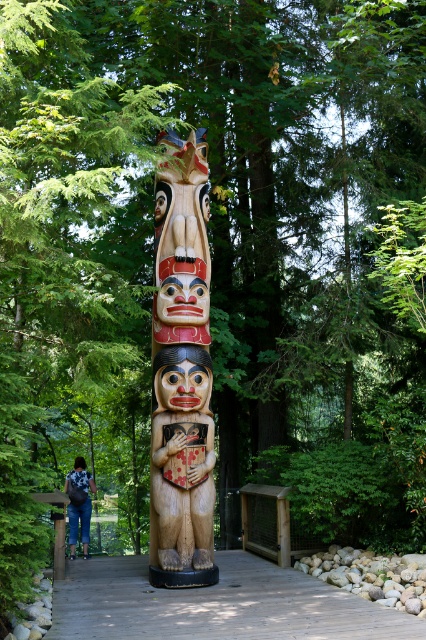
You are standing on the wooden walkway at center and want to reach a nearby bench that is 10 feet away from you. Can you safely walk to the bench without stepping off the walkway?

The wooden walkway at center and viewer are 15.84 feet apart from each other. Since the bench is only 10 feet away from you, you can safely walk to the bench without leaving the walkway as it is within the 15.84 feet distance between you and the walkway.

You are an artist trying to sketch the totem pole. You notice two points on the totem pole labeled as point (276, 596) and point (94, 486). Which point should you focus on first if you want to start drawing the part of the totem pole that is closer to you?

Point (276, 596) is closer to the viewer than point (94, 486), so you should focus on point (276, 596) first.

You are a painter with a 1.5 meter wide canvas. You want to paint the carved wood totem pole at center and the wooden walkway at center in the scene. Can your canvas accommodate both objects side by side?

The carved wood totem pole at center is narrower than the wooden walkway at center. The combined width of both objects would depend on their individual widths. However, since the totem pole is narrower than the walkway, but we don not have exact measurements, it is uncertain if they can fit together on a 1.5 meter canvas. More information is needed to determine this.